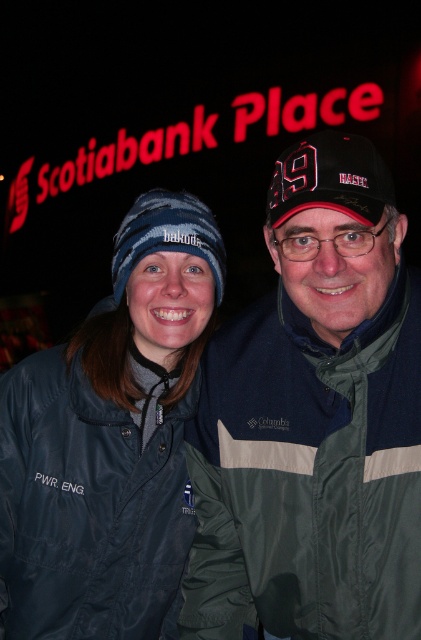
You are trying to locate the dark blue nylon jacket at center in the image. Based on the coordinates provided in the Objects Description, can you determine its position relative to the center of the image?

The dark blue nylon jacket at center is located at coordinates point (111, 440), which means it is positioned to the right and slightly below the center of the image.

Based on the photo, you are a photographer trying to capture both the dark blue nylon jacket at center and the black fabric cap at center in a single frame. Since the jacket is larger, how should you position your camera to ensure both objects are fully visible in the photo?

To capture both the dark blue nylon jacket at center and the black fabric cap at center in the same frame, position the camera farther away from them. This will help reduce the size disparity caused by the dark blue nylon jacket at center being larger than the black fabric cap at center, ensuring both fit within the photo.

You are standing at a point 56.83 feet away from the viewer. Which direction should you move to get closer to the point marked at coordinates point (343, 461)?

The point marked at coordinates point (343, 461) is located 56.83 feet away from the viewer. To move closer to it, you should move forward towards the point marked at coordinates point (343, 461).